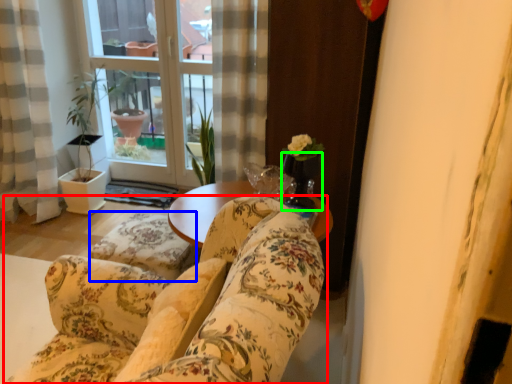
Question: Which is nearer to the studio couch (highlighted by a red box)? flat (highlighted by a blue box) or glass vase (highlighted by a green box).

Choices:
 (A) flat
 (B) glass vase

Answer: (A)